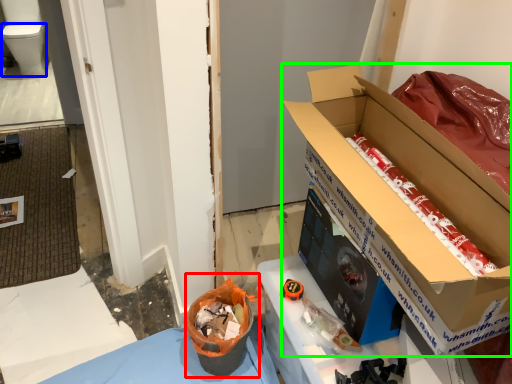
Question: Estimate the real-world distances between objects in this image. Which object is farther from recycling bin (highlighted by a red box), toilet bowl (highlighted by a blue box) or box (highlighted by a green box)?

Choices:
 (A) toilet bowl
 (B) box

Answer: (A)